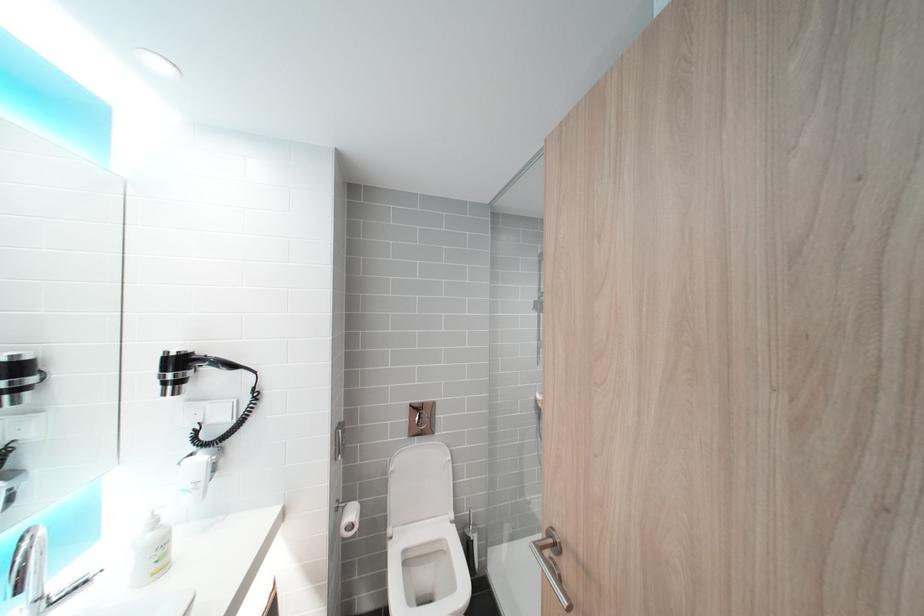
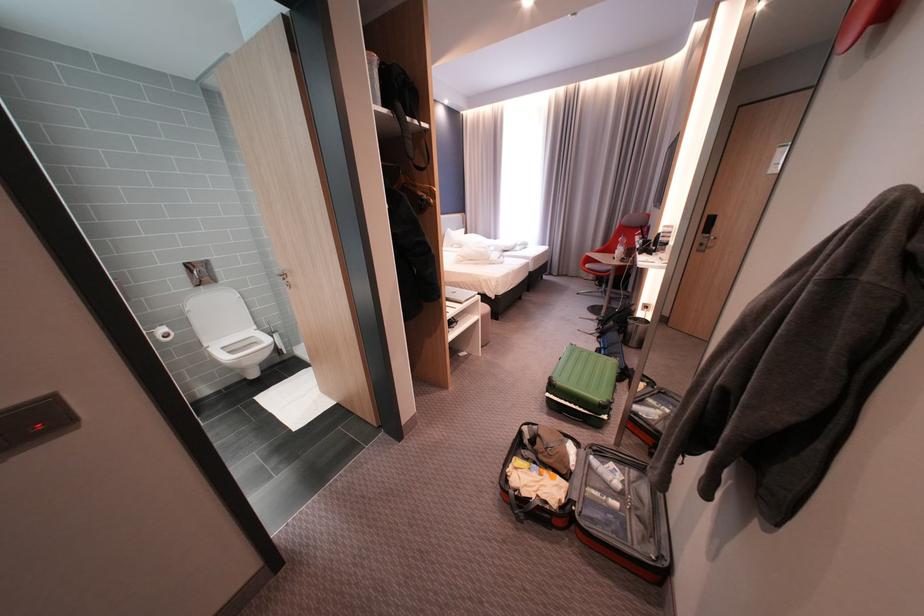
The point at (464, 517) is marked in the first image. Where is the corresponding point in the second image?

(266, 328)